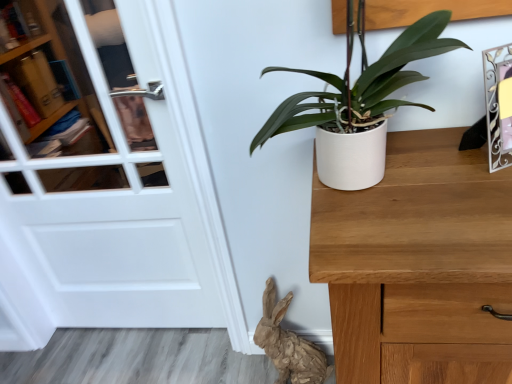
Question: Can we say white glossy door at left lies outside brown paper rabbit at lower center?

Choices:
 (A) yes
 (B) no

Answer: (A)

Question: Can you confirm if white glossy door at left is wider than brown paper rabbit at lower center?

Choices:
 (A) no
 (B) yes

Answer: (A)

Question: Considering the relative positions of white glossy door at left and brown paper rabbit at lower center in the image provided, is white glossy door at left to the left of brown paper rabbit at lower center from the viewer's perspective?

Choices:
 (A) yes
 (B) no

Answer: (A)

Question: Does white glossy door at left contain brown paper rabbit at lower center?

Choices:
 (A) yes
 (B) no

Answer: (B)

Question: From the image's perspective, would you say white glossy door at left is positioned over brown paper rabbit at lower center?

Choices:
 (A) yes
 (B) no

Answer: (A)

Question: From the image's perspective, is white matte pot at center-right positioned above or below white glossy door at left?

Choices:
 (A) below
 (B) above

Answer: (B)

Question: Is white matte pot at center-right wider or thinner than white glossy door at left?

Choices:
 (A) wide
 (B) thin

Answer: (A)

Question: In terms of height, does white matte pot at center-right look taller or shorter compared to white glossy door at left?

Choices:
 (A) tall
 (B) short

Answer: (B)

Question: Considering the relative positions of white matte pot at center-right and white glossy door at left in the image provided, is white matte pot at center-right to the left or to the right of white glossy door at left?

Choices:
 (A) right
 (B) left

Answer: (A)

Question: Would you say metallic silver picture frame at upper right is inside or outside white matte pot at center-right?

Choices:
 (A) outside
 (B) inside

Answer: (A)

Question: Is metallic silver picture frame at upper right bigger or smaller than white matte pot at center-right?

Choices:
 (A) small
 (B) big

Answer: (A)

Question: From a real-world perspective, relative to white matte pot at center-right, is metallic silver picture frame at upper right vertically above or below?

Choices:
 (A) above
 (B) below

Answer: (B)

Question: Based on their positions, is metallic silver picture frame at upper right located to the left or right of white matte pot at center-right?

Choices:
 (A) right
 (B) left

Answer: (A)

Question: Is brown paper rabbit at lower center spatially inside white glossy door at left, or outside of it?

Choices:
 (A) outside
 (B) inside

Answer: (A)

Question: Is brown paper rabbit at lower center wider or thinner than white glossy door at left?

Choices:
 (A) wide
 (B) thin

Answer: (A)